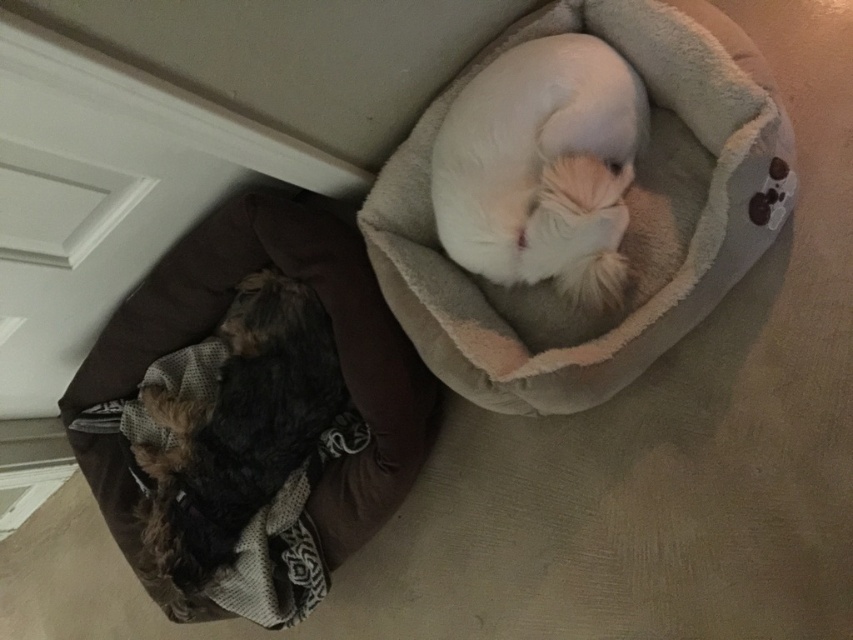
Which is below, white fluffy cat at upper center or fuzzy brown dog at lower left?

Positioned lower is fuzzy brown dog at lower left.

Who is more distant from viewer, (555,42) or (228,451)?

The point (228,451) is more distant.

At what (x,y) coordinates should I click in order to perform the action: click on white fluffy cat at upper center. Please return your answer as a coordinate pair (x, y). The width and height of the screenshot is (853, 640). Looking at the image, I should click on (543, 166).

Which of these two, beige plush cat bed at center or fuzzy brown dog at lower left, stands shorter?

With less height is fuzzy brown dog at lower left.

Can you confirm if beige plush cat bed at center is wider than fuzzy brown dog at lower left?

Yes.

This screenshot has width=853, height=640. Find the location of `beige plush cat bed at center`. beige plush cat bed at center is located at coordinates (628, 225).

The image size is (853, 640). In order to click on brown suede dog bed at lower left in this screenshot , I will do `click(334, 330)`.

Is brown suede dog bed at lower left bigger than fuzzy brown dog at lower left?

Yes.

Is point (322, 227) farther from viewer compared to point (183, 456)?

No, (322, 227) is in front of (183, 456).

Find the location of `brown suede dog bed at lower left`. brown suede dog bed at lower left is located at coordinates tap(334, 330).